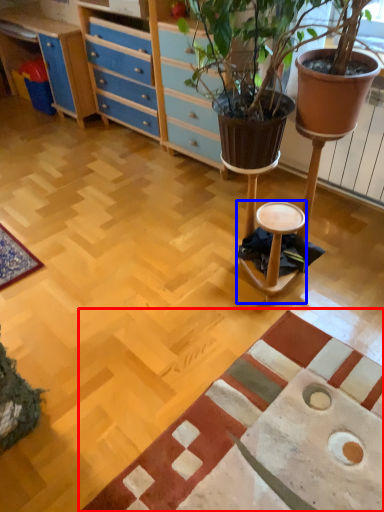
Question: Which object is further to the camera taking this photo, mat (highlighted by a red box) or stool (highlighted by a blue box)?

Choices:
 (A) mat
 (B) stool

Answer: (B)